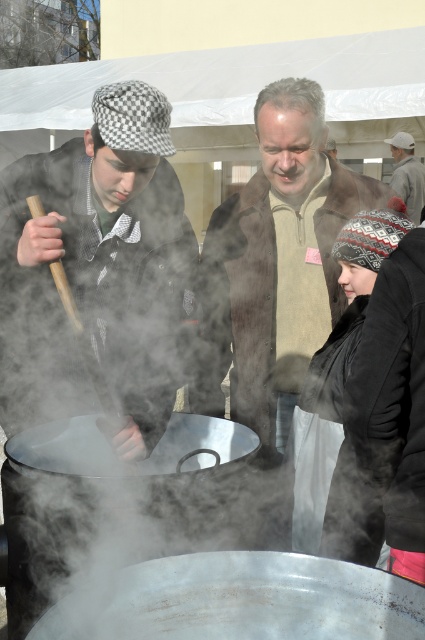
Is checkered fabric hat at left closer to camera compared to brown leather jacket at center?

Yes, checkered fabric hat at left is closer to the viewer.

Who is more forward, (152, 344) or (231, 320)?

Point (152, 344) is in front.

Where is `checkered fabric hat at left`? The image size is (425, 640). checkered fabric hat at left is located at coordinates (99, 268).

The height and width of the screenshot is (640, 425). Describe the element at coordinates (275, 262) in the screenshot. I see `brown leather jacket at center` at that location.

Who is taller, brown leather jacket at center or gray knit hat at upper right?

brown leather jacket at center

Where is `brown leather jacket at center`? brown leather jacket at center is located at coordinates (275, 262).

Who is more distant from viewer, (155, 320) or (391, 141)?

The point (391, 141) is behind.

Who is shorter, checkered fabric hat at left or gray knit hat at upper right?

checkered fabric hat at left is shorter.

Is point (70, 198) farther from camera compared to point (396, 140)?

No, (70, 198) is in front of (396, 140).

This screenshot has height=640, width=425. Find the location of `checkered fabric hat at left`. checkered fabric hat at left is located at coordinates (99, 268).